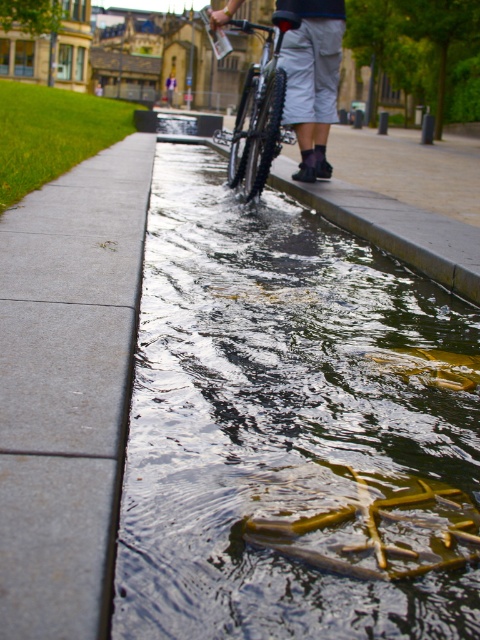
Is shiny metallic bicycle at center to the right of dark blue jeans at center from the viewer's perspective?

Correct, you'll find shiny metallic bicycle at center to the right of dark blue jeans at center.

Where is `shiny metallic bicycle at center`? This screenshot has width=480, height=640. shiny metallic bicycle at center is located at coordinates (260, 109).

Is point (129, 540) more distant than point (98, 532)?

Yes, point (129, 540) is farther from viewer.

Does clear water at center have a greater height compared to gray concrete sidewalk at left?

In fact, clear water at center may be shorter than gray concrete sidewalk at left.

Is point (393, 304) behind point (124, 346)?

Yes.

The image size is (480, 640). Identify the location of clear water at center. (282, 419).

Who is positioned more to the right, clear water at center or dark blue jeans at center?

Positioned to the right is clear water at center.

Who is more forward, [368,328] or [169,84]?

Point [368,328]

Is point (266, 404) behind point (168, 88)?

No, (266, 404) is in front of (168, 88).

Where is `clear water at center`? The width and height of the screenshot is (480, 640). clear water at center is located at coordinates (282, 419).